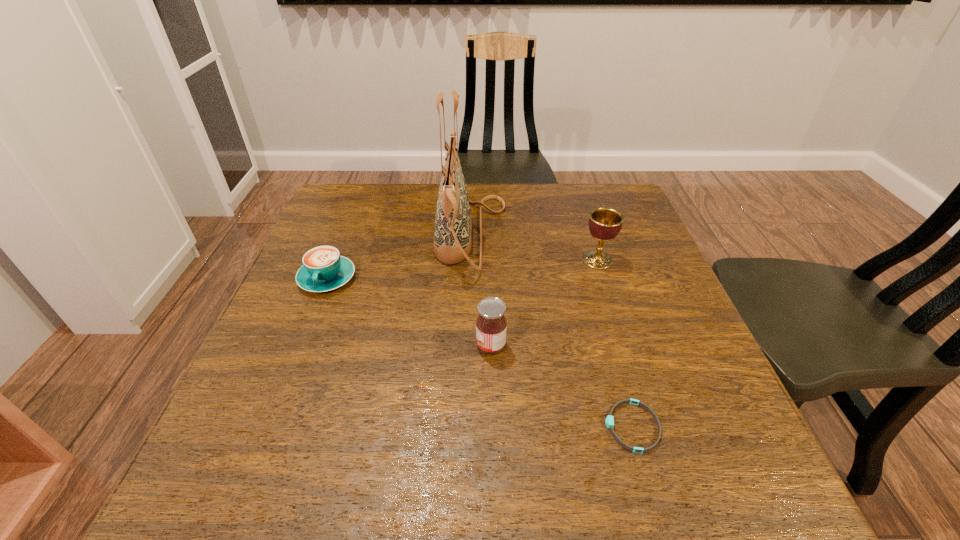
In order to click on the tallest object in this screenshot , I will do `click(453, 224)`.

Image resolution: width=960 pixels, height=540 pixels. I want to click on chalice, so coord(605,223).

Locate an element on the screen. The image size is (960, 540). the third shortest object is located at coordinates tap(491, 325).

At what (x,y) coordinates should I click in order to perform the action: click on jam. Please return your answer as a coordinate pair (x, y). Looking at the image, I should click on (491, 325).

At what (x,y) coordinates should I click in order to perform the action: click on the fourth tallest object. Please return your answer as a coordinate pair (x, y). Looking at the image, I should click on (323, 269).

In order to click on cappuccino in this screenshot , I will do `click(323, 269)`.

The image size is (960, 540). I want to click on the shortest object, so click(x=609, y=420).

The width and height of the screenshot is (960, 540). In order to click on wristband in this screenshot , I will do `click(609, 420)`.

At what (x,y) coordinates should I click in order to perform the action: click on vacant space located 0.170m on the front-facing side of the handbag. Please return your answer as a coordinate pair (x, y). Image resolution: width=960 pixels, height=540 pixels. Looking at the image, I should click on (572, 237).

Identify the location of vacant space located on the back of the chalice. This screenshot has width=960, height=540. (573, 184).